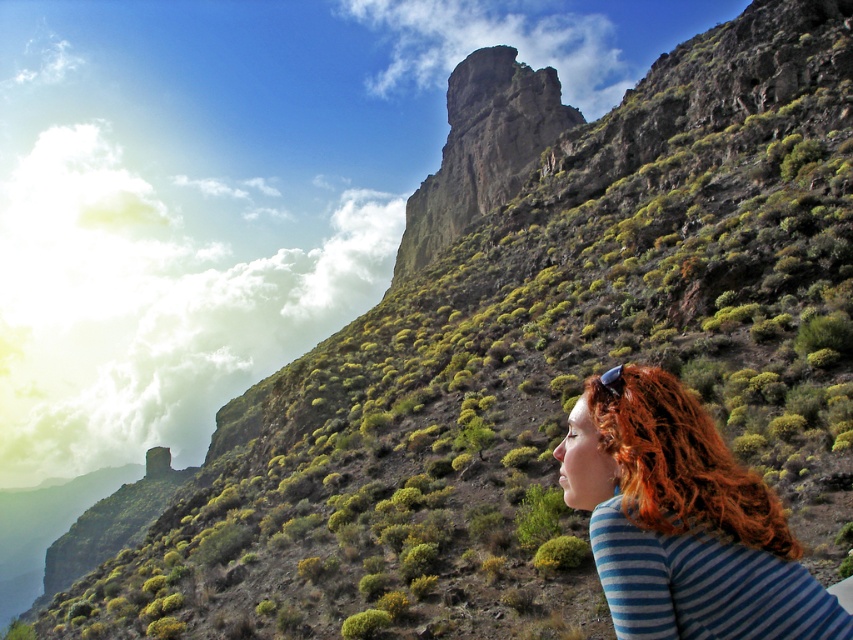
Is point (686, 628) farther from camera compared to point (492, 116)?

No, (686, 628) is closer to viewer.

Can you confirm if blonde hair at lower right is smaller than rusty stone cliff at center?

Correct, blonde hair at lower right occupies less space than rusty stone cliff at center.

Between point (680, 490) and point (444, 161), which one is positioned behind?

Point (444, 161)

Identify the location of blonde hair at lower right. The width and height of the screenshot is (853, 640). (683, 520).